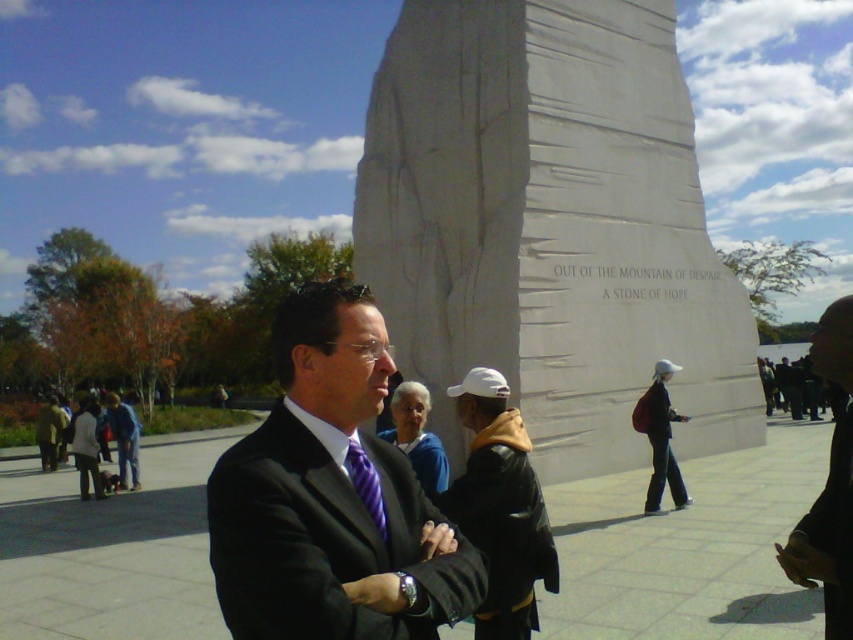
Question: Does white stone monument at center come behind matte black suit at center?

Choices:
 (A) yes
 (B) no

Answer: (A)

Question: Is matte black suit at center above blue denim jacket at left?

Choices:
 (A) yes
 (B) no

Answer: (A)

Question: Is black suit at center wider than purple striped tie at center?

Choices:
 (A) yes
 (B) no

Answer: (A)

Question: Among these points, which one is nearest to the camera?

Choices:
 (A) (587, 65)
 (B) (527, 445)
 (C) (791, 540)

Answer: (C)

Question: Based on their relative distances, which object is farther from the blue denim jacket at left?

Choices:
 (A) white stone monument at center
 (B) purple striped tie at center
 (C) dark suit at center

Answer: (C)

Question: Which of the following is the closest to the observer?

Choices:
 (A) (822, 556)
 (B) (381, 513)

Answer: (B)